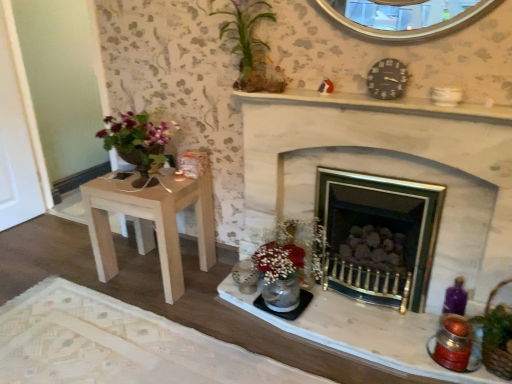
Question: From the image's perspective, is black plastic clock at upper right above white stone fireplace at center?

Choices:
 (A) no
 (B) yes

Answer: (B)

Question: Does black plastic clock at upper right have a smaller size compared to white stone fireplace at center?

Choices:
 (A) no
 (B) yes

Answer: (B)

Question: Considering the relative sizes of black plastic clock at upper right and white stone fireplace at center in the image provided, is black plastic clock at upper right bigger than white stone fireplace at center?

Choices:
 (A) yes
 (B) no

Answer: (B)

Question: From a real-world perspective, does black plastic clock at upper right sit lower than white stone fireplace at center?

Choices:
 (A) yes
 (B) no

Answer: (B)

Question: Can white stone fireplace at center be found inside black plastic clock at upper right?

Choices:
 (A) no
 (B) yes

Answer: (A)

Question: From a real-world perspective, is green leafy plant at upper center positioned above or below black plastic clock at upper right?

Choices:
 (A) above
 (B) below

Answer: (A)

Question: Does point (260, 72) appear closer or farther from the camera than point (401, 92)?

Choices:
 (A) closer
 (B) farther

Answer: (B)

Question: Looking at the image, does green leafy plant at upper center seem bigger or smaller compared to black plastic clock at upper right?

Choices:
 (A) small
 (B) big

Answer: (B)

Question: Based on their positions, is green leafy plant at upper center located to the left or right of black plastic clock at upper right?

Choices:
 (A) left
 (B) right

Answer: (A)

Question: Relative to black plastic clock at upper right, is white stone fireplace at center in front or behind?

Choices:
 (A) behind
 (B) front

Answer: (B)

Question: From the image's perspective, is white stone fireplace at center positioned above or below black plastic clock at upper right?

Choices:
 (A) above
 (B) below

Answer: (B)

Question: Visually, is white stone fireplace at center positioned to the left or to the right of black plastic clock at upper right?

Choices:
 (A) right
 (B) left

Answer: (A)

Question: Considering the positions of white stone fireplace at center and black plastic clock at upper right in the image, is white stone fireplace at center wider or thinner than black plastic clock at upper right?

Choices:
 (A) wide
 (B) thin

Answer: (A)

Question: Looking at the image, does black plastic clock at upper right seem bigger or smaller compared to white marble mantel at upper center?

Choices:
 (A) big
 (B) small

Answer: (B)

Question: Considering their positions, is black plastic clock at upper right located in front of or behind white marble mantel at upper center?

Choices:
 (A) behind
 (B) front

Answer: (A)